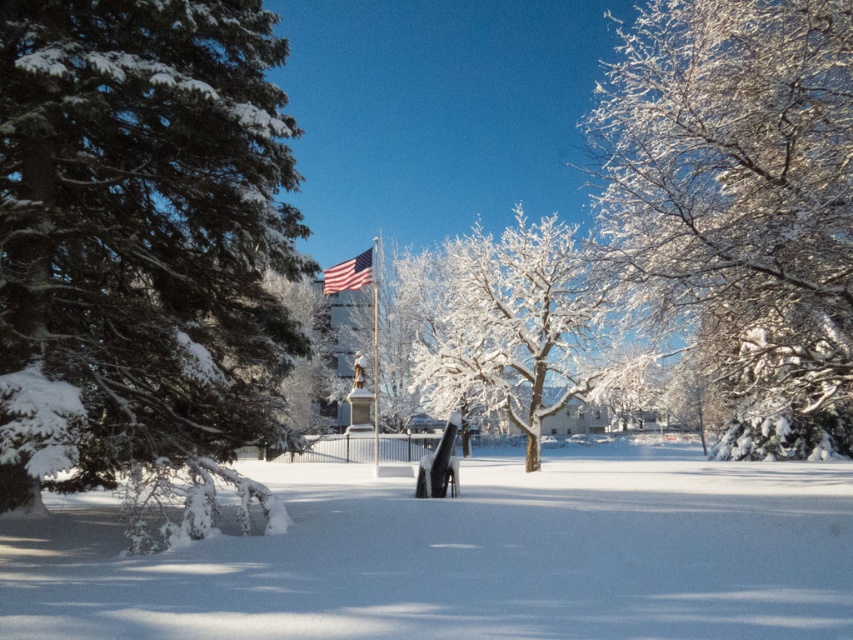
Question: Which point is closer to the camera?

Choices:
 (A) polished metal flag pole at center
 (B) american flag at center
 (C) white frosty branches at upper right
 (D) snow-covered evergreen tree at left

Answer: (D)

Question: Which point appears closest to the camera in this image?

Choices:
 (A) (375, 378)
 (B) (338, 278)

Answer: (B)

Question: Is white fluffy snow at center wider than white frosty tree at center?

Choices:
 (A) no
 (B) yes

Answer: (B)

Question: Considering the relative positions of white fluffy snow at center and american flag at center in the image provided, where is white fluffy snow at center located with respect to american flag at center?

Choices:
 (A) right
 (B) left

Answer: (A)

Question: Is white frosty tree at center to the right of polished metal flag pole at center from the viewer's perspective?

Choices:
 (A) no
 (B) yes

Answer: (B)

Question: Which of these objects is positioned farthest from the polished metal flag pole at center?

Choices:
 (A) american flag at center
 (B) white frosty branches at upper right
 (C) snow-covered evergreen tree at left

Answer: (C)